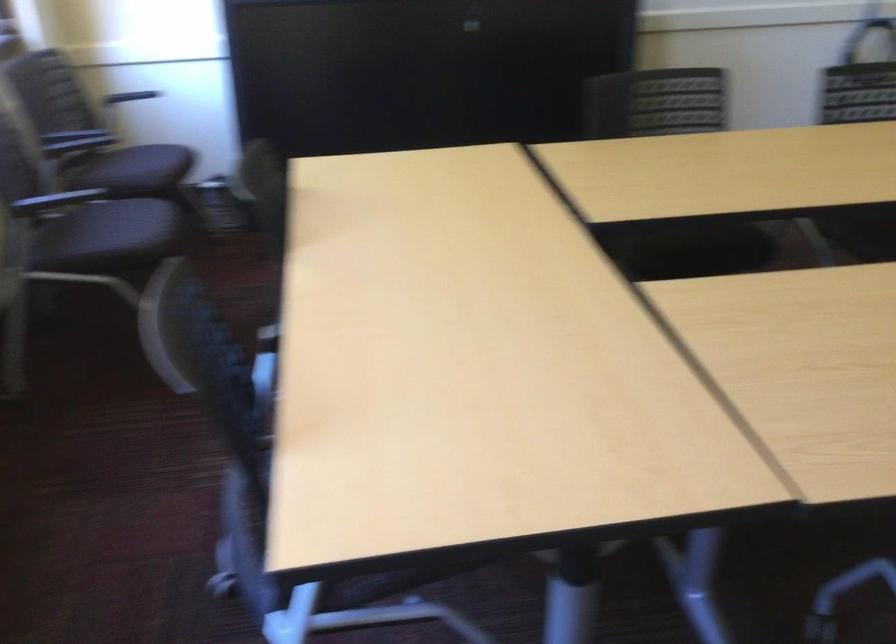
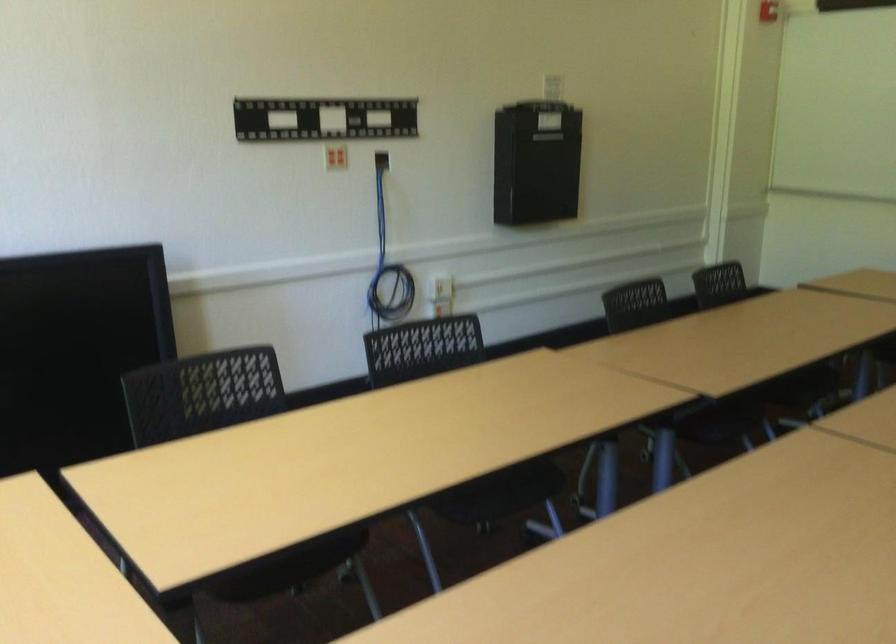
Question: How did the camera likely rotate?

Choices:
 (A) Left
 (B) Right
 (C) Up
 (D) Down

Answer: (B)